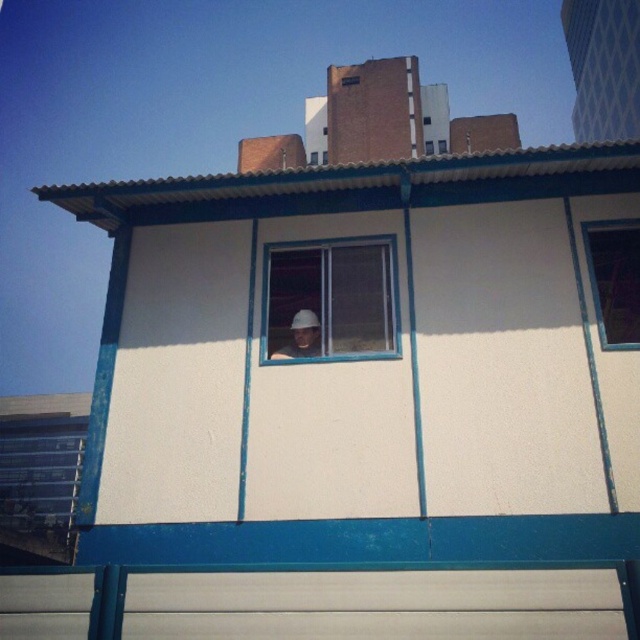
Question: Is white matte helmet at center bigger than white plastic window at center?

Choices:
 (A) no
 (B) yes

Answer: (A)

Question: Which point is farther from the camera taking this photo?

Choices:
 (A) (444, 144)
 (B) (637, 262)
 (C) (358, 294)

Answer: (A)

Question: Does transparent glass window at upper right have a greater width compared to white plastic window at center?

Choices:
 (A) yes
 (B) no

Answer: (A)

Question: Considering the real-world distances, which object is closest to the transparent glass window at upper right?

Choices:
 (A) transparent plastic window at center
 (B) white matte helmet at center
 (C) white plastic window at center

Answer: (A)

Question: Which object appears closest to the camera in this image?

Choices:
 (A) transparent plastic window at center
 (B) transparent glass window at upper right
 (C) white matte helmet at center

Answer: (A)

Question: Does transparent plastic window at center come in front of transparent glass window at upper right?

Choices:
 (A) yes
 (B) no

Answer: (A)